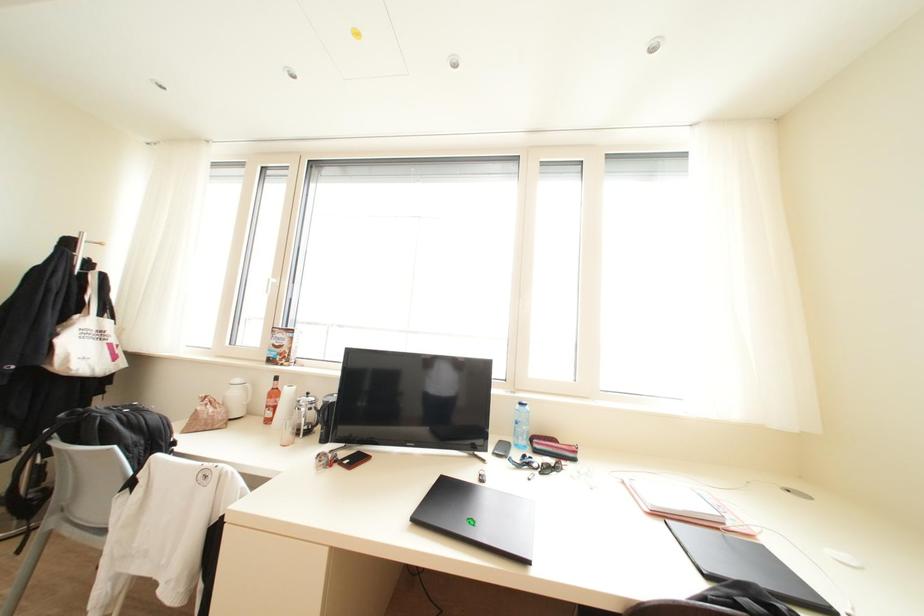
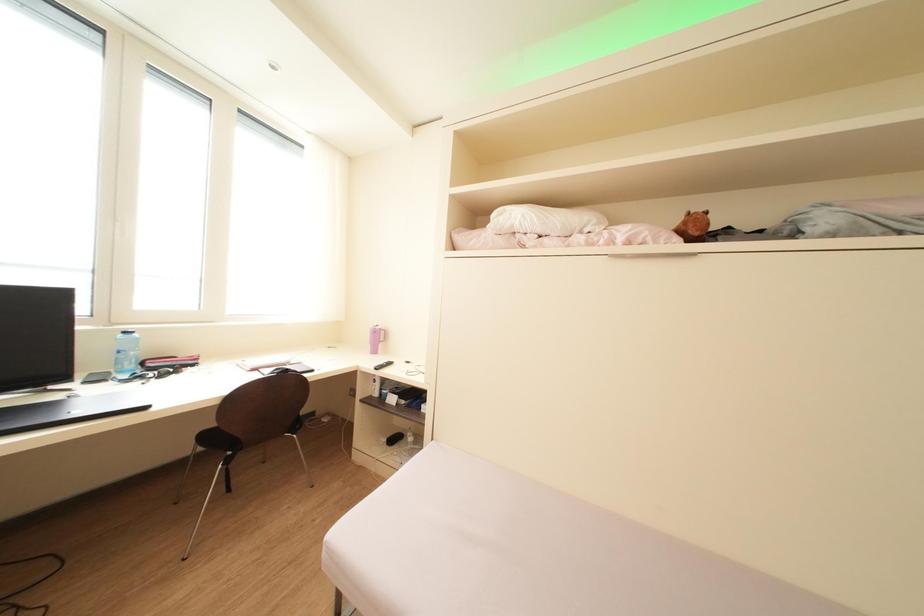
Question: Based on the continuous images, in which direction is the camera rotating? Reply with the corresponding letter.

Choices:
 (A) Left
 (B) Right
 (C) Up
 (D) Down

Answer: (B)